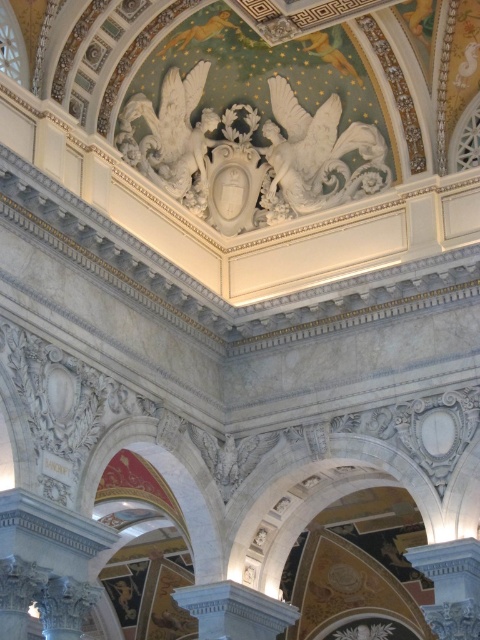
Question: Is white marble eagle at upper center above white marble column at center?

Choices:
 (A) no
 (B) yes

Answer: (B)

Question: In this image, where is white marble sculpture at upper center located relative to white marble column at center?

Choices:
 (A) below
 (B) above

Answer: (B)

Question: Which of the following is the farthest from the observer?

Choices:
 (A) (120, 124)
 (B) (309, 154)
 (C) (439, 605)
 (D) (240, 612)

Answer: (B)

Question: Which of the following is the farthest from the observer?

Choices:
 (A) (222, 624)
 (B) (159, 136)
 (C) (348, 131)

Answer: (C)

Question: Which of the following is the closest to the observer?

Choices:
 (A) white marble column at lower right
 (B) white marble sculpture at upper center
 (C) white marble eagle at upper center

Answer: (A)

Question: Can you confirm if white marble eagle at upper center is bigger than white marble sculpture at upper center?

Choices:
 (A) no
 (B) yes

Answer: (A)